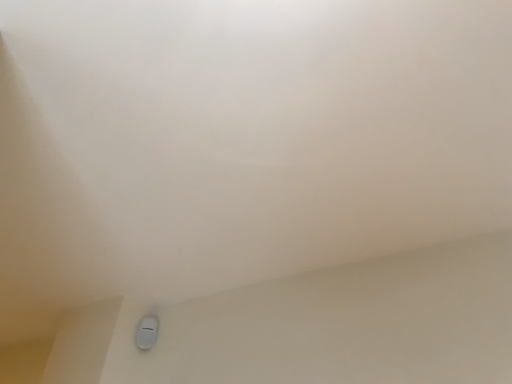
This screenshot has height=384, width=512. Describe the element at coordinates (147, 332) in the screenshot. I see `white plastic switch at lower left` at that location.

Identify the location of white plastic switch at lower left. The width and height of the screenshot is (512, 384). (147, 332).

The height and width of the screenshot is (384, 512). Find the location of `white plastic switch at lower left`. white plastic switch at lower left is located at coordinates (147, 332).